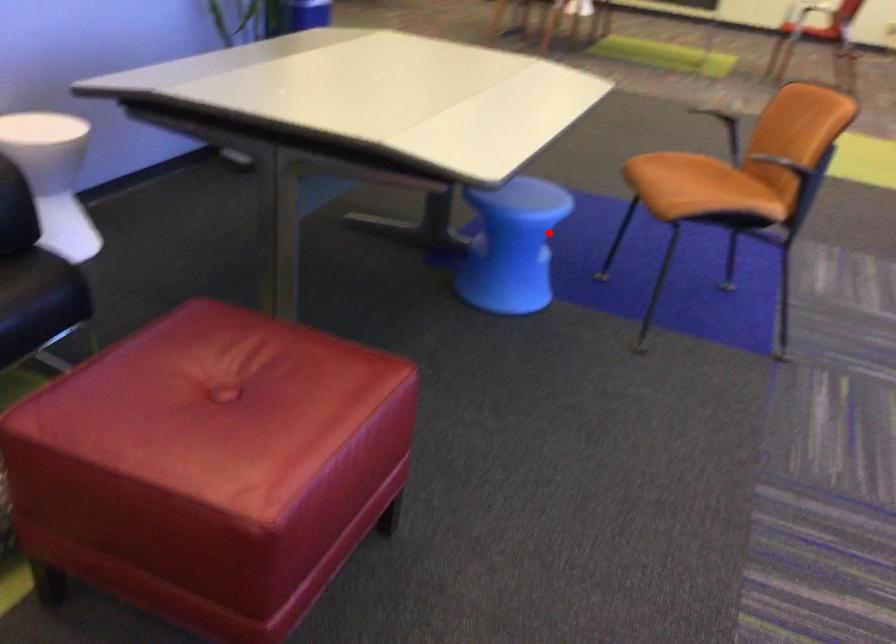
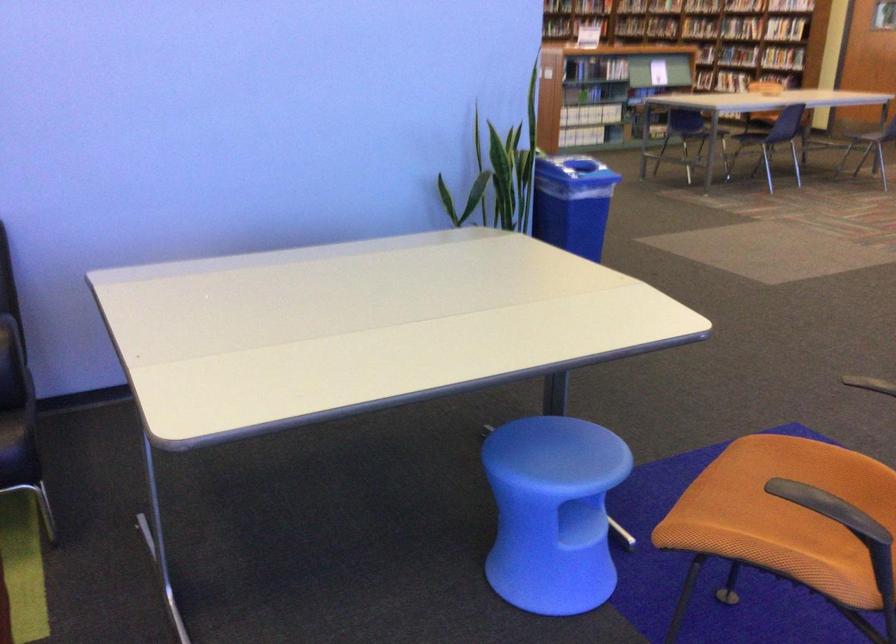
In the second image, find the point that corresponds to the highlighted location in the first image.

(553, 512)